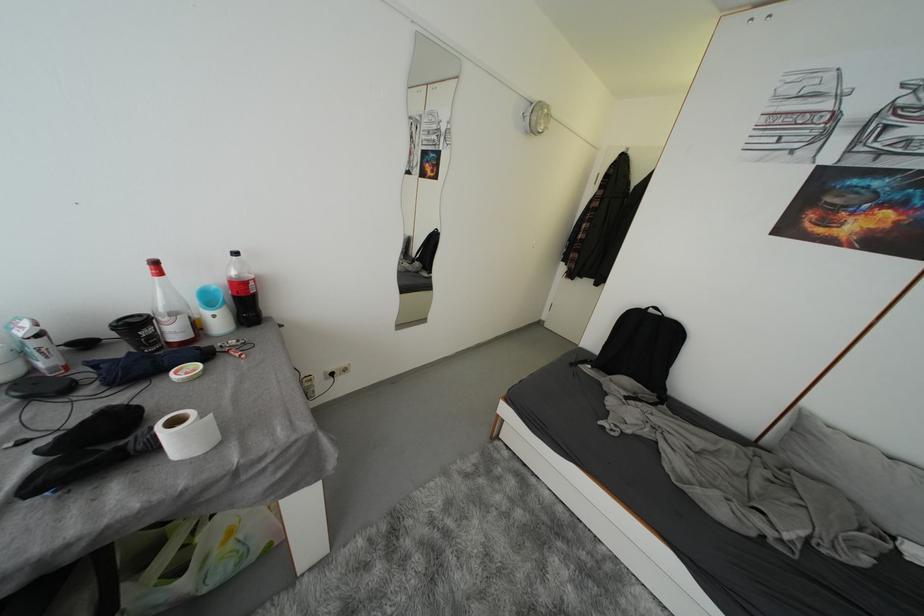
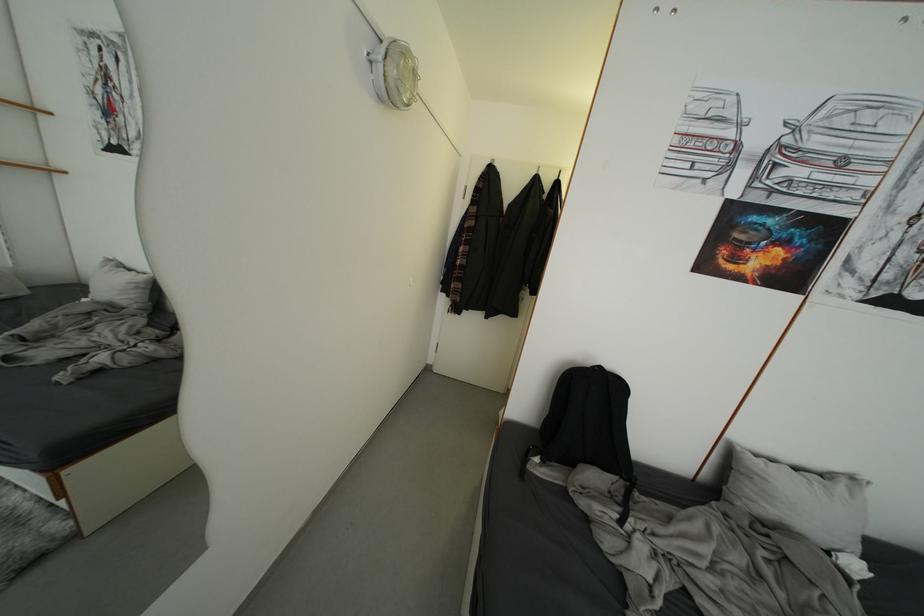
Question: Based on the continuous images, in which direction is the camera rotating? Reply with the corresponding letter.

Choices:
 (A) Left
 (B) Right
 (C) Up
 (D) Down

Answer: (B)